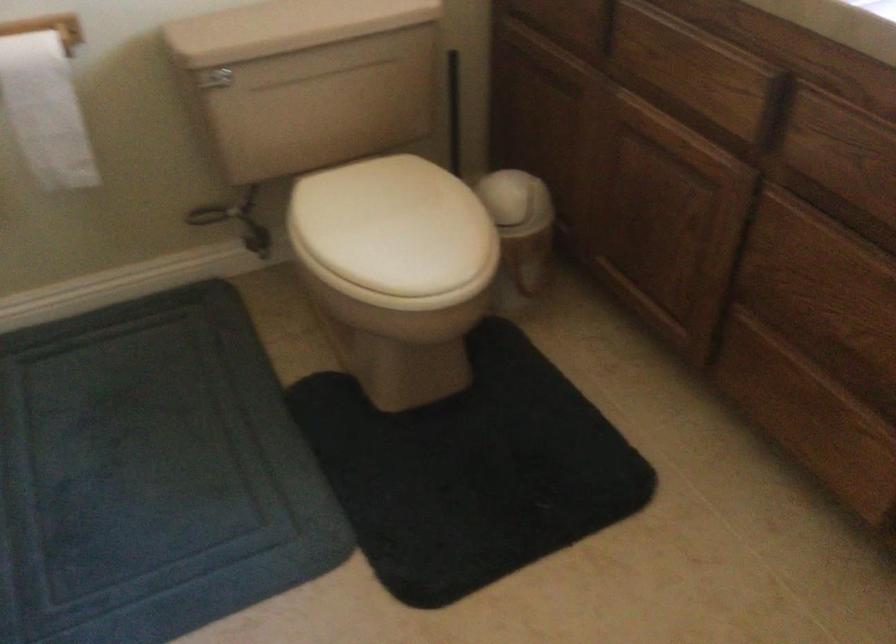
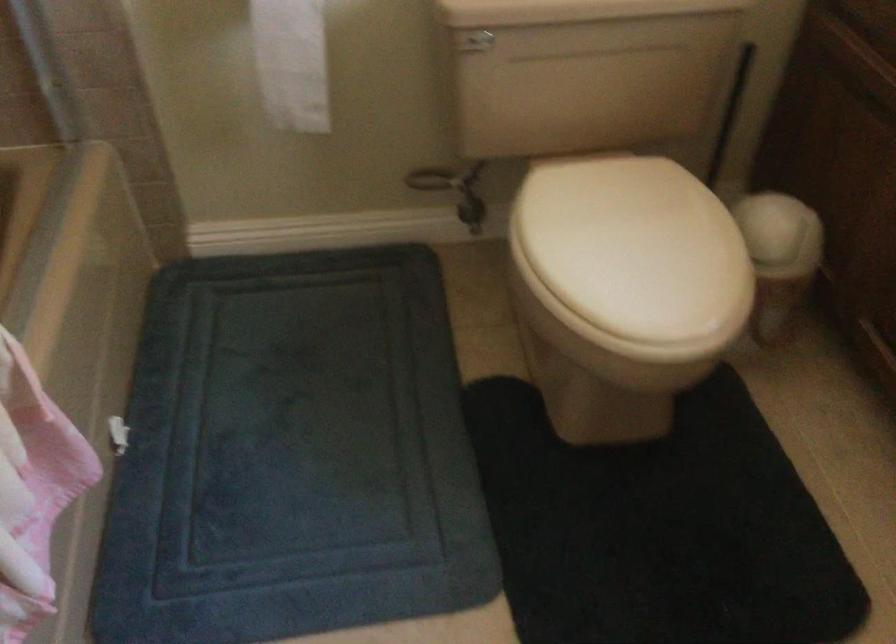
Where in the second image is the point corresponding to pixel 519 200 from the first image?

(780, 234)